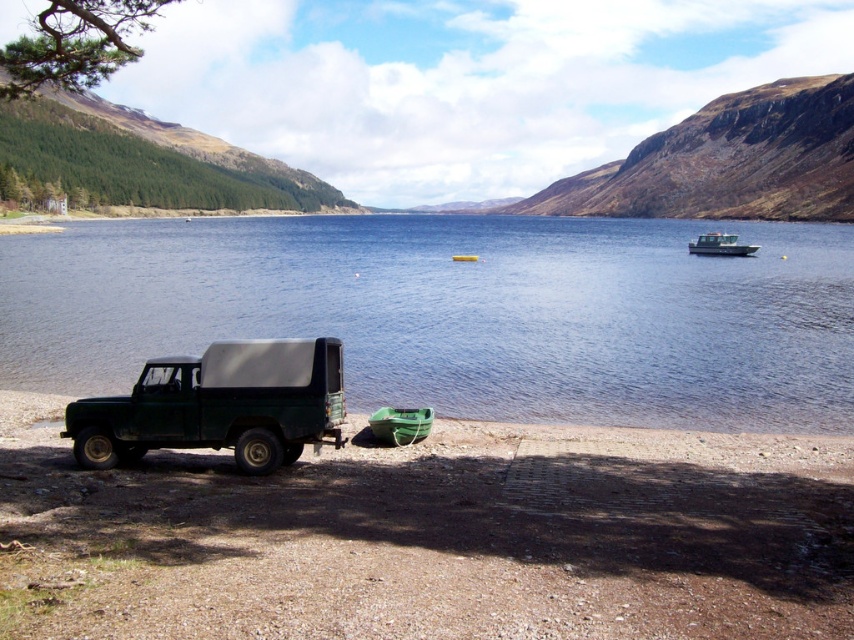
Question: Is blue water at center smaller than white plastic boat at center?

Choices:
 (A) no
 (B) yes

Answer: (A)

Question: Estimate the real-world distances between objects in this image. Which object is closer to the blue water at center?

Choices:
 (A) green rubber boat at lower left
 (B) green rubber boat at center
 (C) white plastic boat at center

Answer: (B)

Question: Which point appears closest to the camera in this image?

Choices:
 (A) (372, 419)
 (B) (527, 449)

Answer: (B)

Question: Can you confirm if blue water at center is wider than white plastic boat at center?

Choices:
 (A) no
 (B) yes

Answer: (B)

Question: Does green rubber boat at lower center appear over white plastic boat at center?

Choices:
 (A) yes
 (B) no

Answer: (B)

Question: Which of the following is the closest to the observer?

Choices:
 (A) blue water at center
 (B) white plastic boat at center
 (C) green rubber boat at center
 (D) green rubber boat at lower center

Answer: (D)